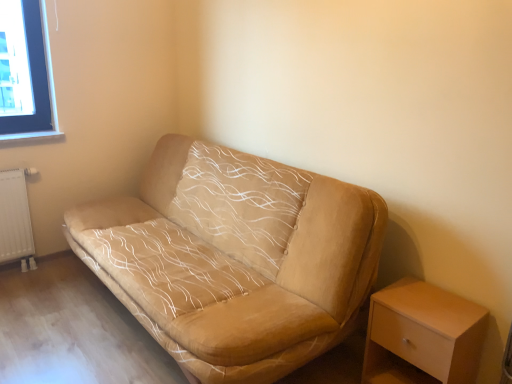
What are the coordinates of `free space that is in between beige fabric couch at center and white textured radiator at lower left` in the screenshot? It's located at 70,312.